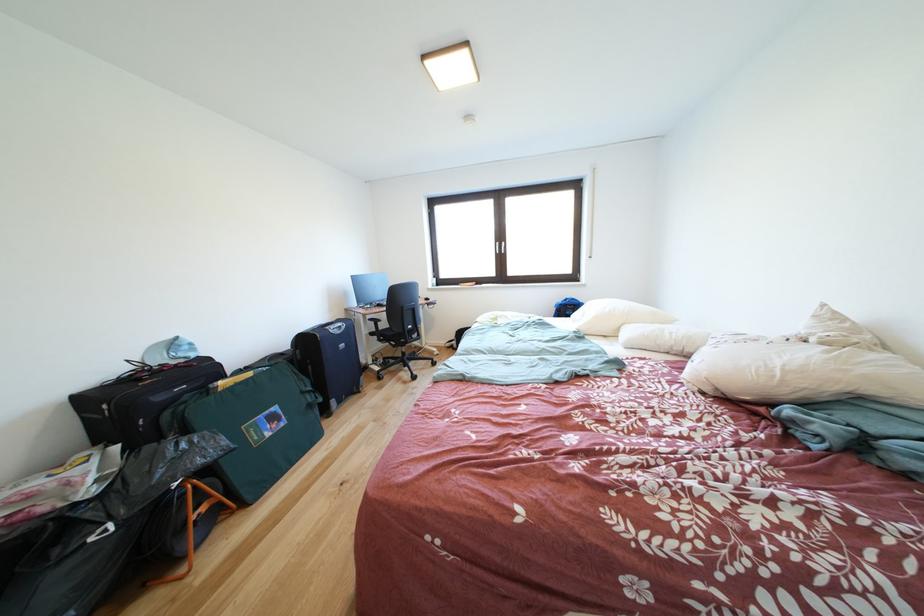
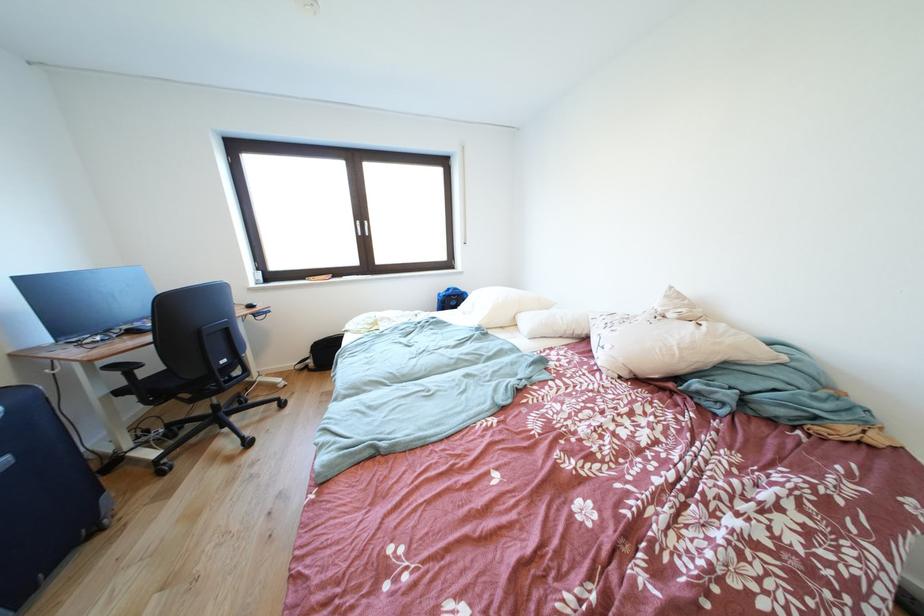
Find the pixel in the second image that matches the point at 505,249 in the first image.

(367, 228)